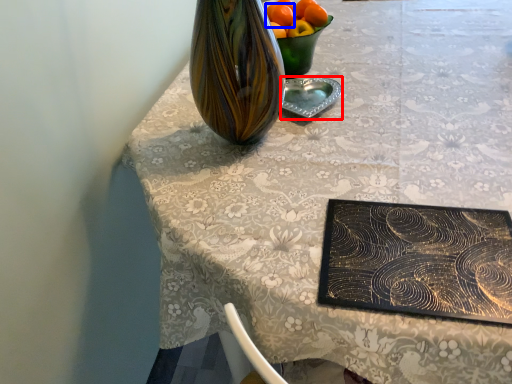
Question: Which object appears farthest to the camera in this image, tableware (highlighted by a red box) or orange (highlighted by a blue box)?

Choices:
 (A) tableware
 (B) orange

Answer: (B)